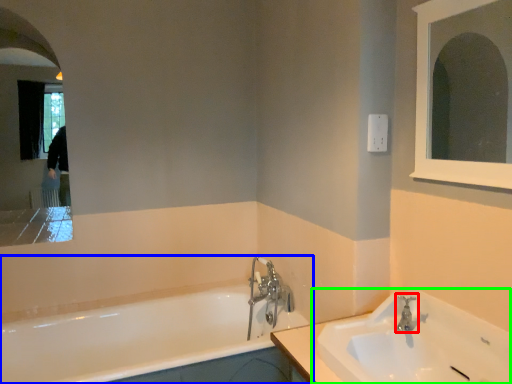
Question: Which is farther away from tap (highlighted by a red box)? bathtub (highlighted by a blue box) or sink (highlighted by a green box)?

Choices:
 (A) bathtub
 (B) sink

Answer: (A)